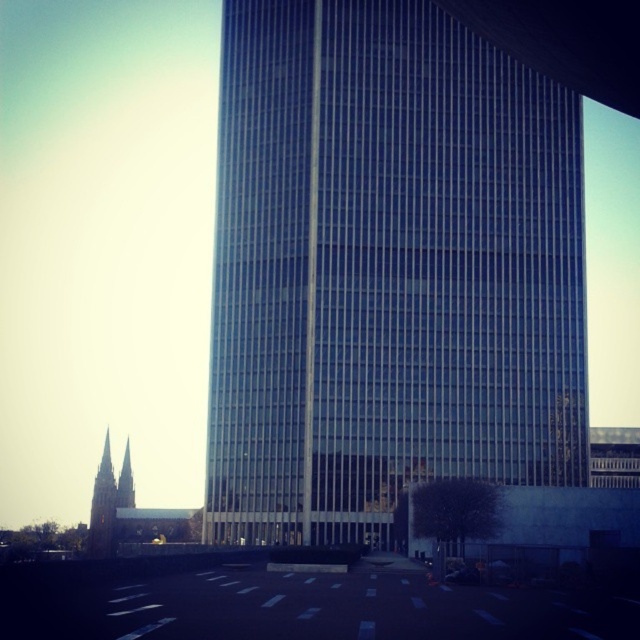
You are a drone operator who needs to fly a drone from the transparent glass tower at center to the golden stone spire at left. Considering their positions, will the drone have an unobstructed path between them?

The transparent glass tower at center is in front of the golden stone spire at left, so the drone will not have an unobstructed path between them because the transparent glass tower at center is blocking the way.

In the scene shown: You are a city planner reviewing this urban layout. You need to determine the spatial relationship between the transparent glass tower at center and the golden stone spire at left. Which object is located to the right of the other?

The transparent glass tower at center is positioned on the right side of golden stone spire at left.